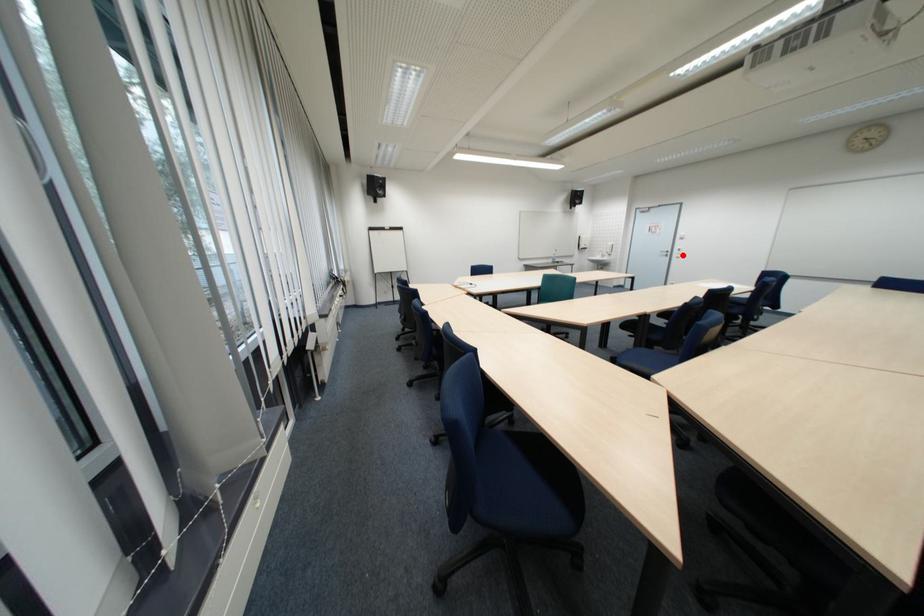
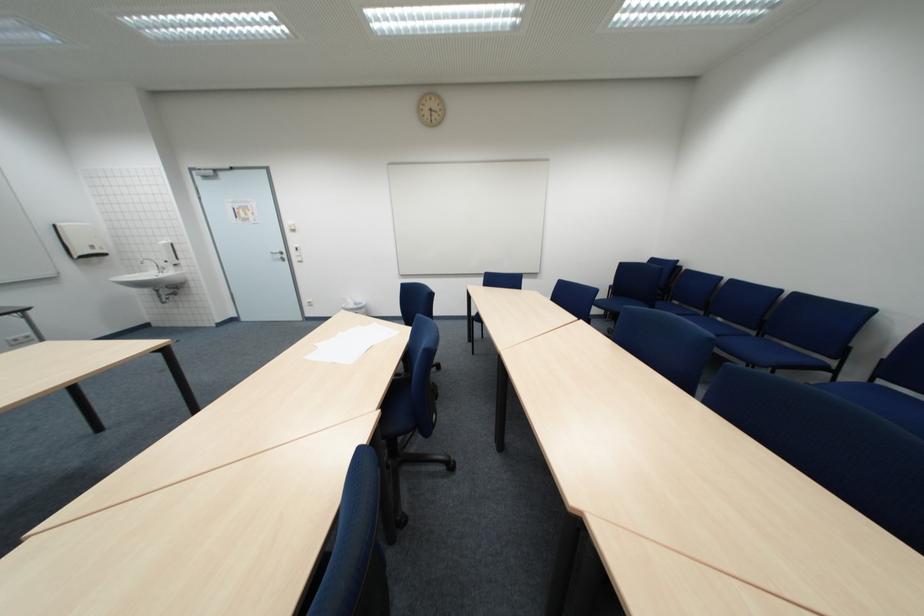
Locate, in the second image, the point that corresponds to the highlighted location in the first image.

(299, 257)